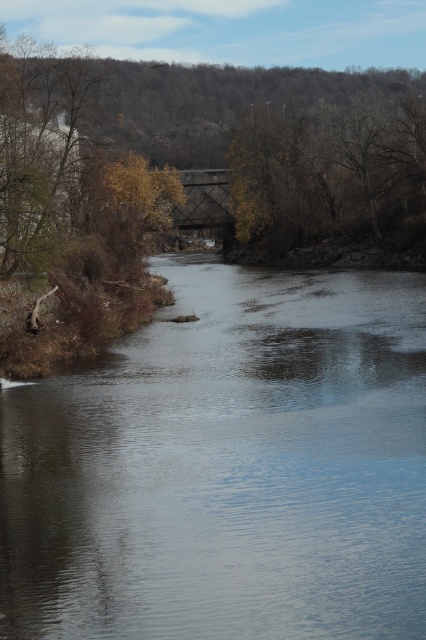
You are a hiker who wants to cross the river using a fallen tree trunk. The clear water at center is flowing gently. Can you safely walk across the fallen tree trunk to reach the brown leafy tree at upper center?

The clear water at center is 46.55 meters away from the brown leafy tree at upper center. Since the distance between them is quite large, the fallen tree trunk may not be long enough to safely span that distance. It would be risky to attempt crossing without knowing the exact length of the tree trunk.

You are an environmental scientist analyzing this river scene. You observe the clear water at center and the brown leafy tree at upper center. Which of these two elements takes up more area in the image?

The brown leafy tree at upper center occupies more space than the clear water at center in the image.

You are standing at the origin point of the coordinate system in the river scene. You want to reach the clear water at center. What direction should you move in to get there?

The clear water at center is located at coordinate point (x=227, y=467), so you should move towards the right and slightly forward to reach it.